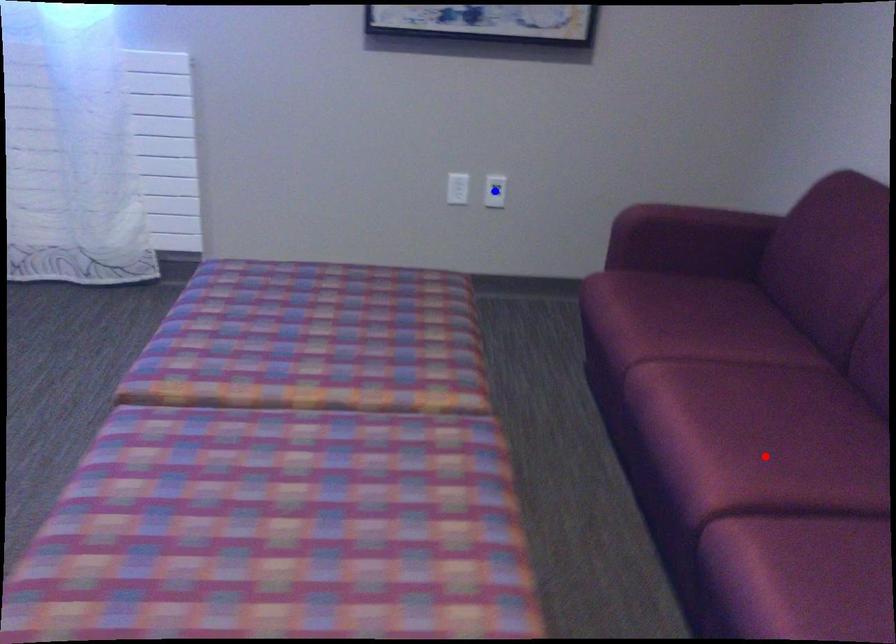
Question: Which of the two points in the image is closer to the camera?

Choices:
 (A) Blue point is closer.
 (B) Red point is closer.

Answer: (B)